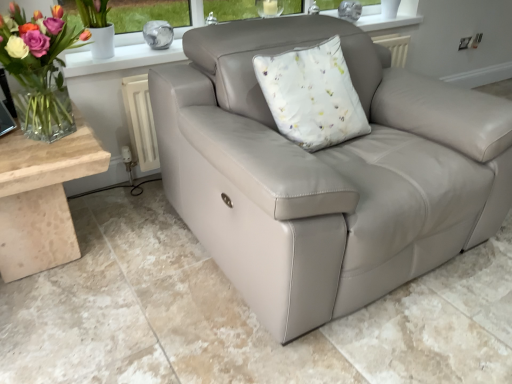
Question: Are beige marble table at lower left and matte leather couch at center beside each other?

Choices:
 (A) yes
 (B) no

Answer: (B)

Question: From the image's perspective, is beige marble table at lower left located beneath matte leather couch at center?

Choices:
 (A) yes
 (B) no

Answer: (A)

Question: Is the position of beige marble table at lower left more distant than that of matte leather couch at center?

Choices:
 (A) no
 (B) yes

Answer: (B)

Question: From the image's perspective, is beige marble table at lower left located above matte leather couch at center?

Choices:
 (A) no
 (B) yes

Answer: (A)

Question: Can you confirm if beige marble table at lower left is shorter than matte leather couch at center?

Choices:
 (A) no
 (B) yes

Answer: (A)

Question: Considering the relative sizes of beige marble table at lower left and matte leather couch at center in the image provided, is beige marble table at lower left wider than matte leather couch at center?

Choices:
 (A) yes
 (B) no

Answer: (B)

Question: Can you confirm if beige marble table at lower left is positioned to the left of clear glass vase at left?

Choices:
 (A) yes
 (B) no

Answer: (A)

Question: Does beige marble table at lower left appear on the right side of clear glass vase at left?

Choices:
 (A) yes
 (B) no

Answer: (B)

Question: Does beige marble table at lower left turn towards clear glass vase at left?

Choices:
 (A) no
 (B) yes

Answer: (A)

Question: From a real-world perspective, is beige marble table at lower left physically above clear glass vase at left?

Choices:
 (A) yes
 (B) no

Answer: (B)

Question: Are beige marble table at lower left and clear glass vase at left making contact?

Choices:
 (A) yes
 (B) no

Answer: (B)

Question: Is beige marble table at lower left not inside clear glass vase at left?

Choices:
 (A) yes
 (B) no

Answer: (A)

Question: Is clear glass vase at left wider than beige marble table at lower left?

Choices:
 (A) yes
 (B) no

Answer: (B)